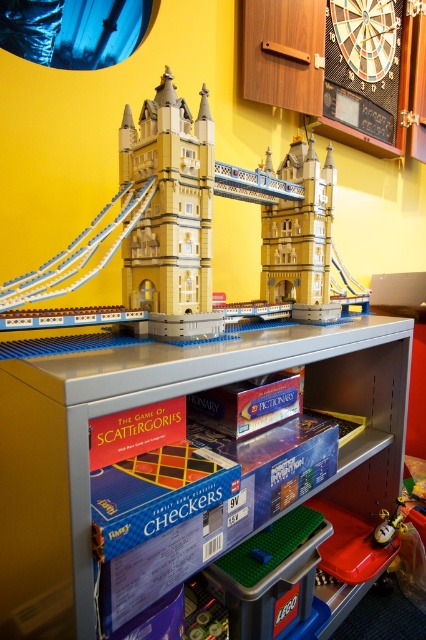
Can you confirm if metallic gray shelf at center is positioned to the left of yellow matte lego bridge at center?

Incorrect, metallic gray shelf at center is not on the left side of yellow matte lego bridge at center.

Can you confirm if metallic gray shelf at center is wider than yellow matte lego bridge at center?

Correct, the width of metallic gray shelf at center exceeds that of yellow matte lego bridge at center.

This screenshot has width=426, height=640. What do you see at coordinates (161, 400) in the screenshot? I see `metallic gray shelf at center` at bounding box center [161, 400].

Identify the location of metallic gray shelf at center. The image size is (426, 640). (161, 400).